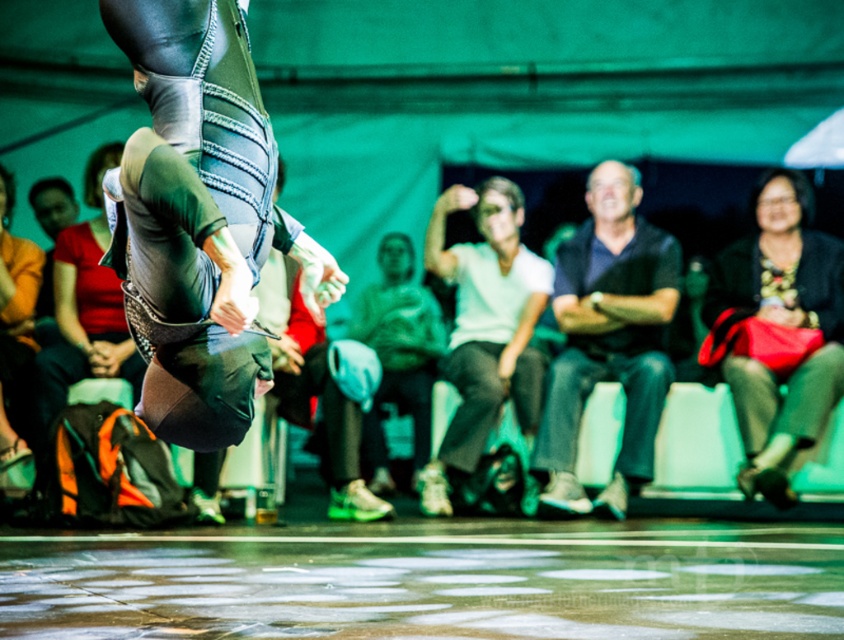
Between point (774, 484) and point (19, 340), which one is positioned behind?

Positioned behind is point (19, 340).

Does matte black sweater at right appear under orange fabric at lower left?

Correct, matte black sweater at right is located below orange fabric at lower left.

Is point (821, 305) less distant than point (14, 305)?

No, (821, 305) is further to viewer.

Where is `matte black sweater at right`? The image size is (844, 640). matte black sweater at right is located at coordinates (778, 328).

Can you confirm if white matte shirt at center is positioned above orange fabric at lower left?

Actually, white matte shirt at center is below orange fabric at lower left.

Who is more distant from viewer, (461, 381) or (14, 436)?

The point (461, 381) is behind.

This screenshot has width=844, height=640. What are the coordinates of `white matte shirt at center` in the screenshot? It's located at (485, 326).

Looking at this image, is dark blue shirt at center below white matte shirt at center?

No.

Find the location of a particular element. This screenshot has width=844, height=640. dark blue shirt at center is located at coordinates (609, 339).

Locate an element on the screen. The width and height of the screenshot is (844, 640). dark blue shirt at center is located at coordinates (609, 339).

You are a GUI agent. You are given a task and a screenshot of the screen. Output one action in this format:
    pyautogui.click(x=<x>, y=<y>)
    Task: Click on the dark blue shirt at center
    The width and height of the screenshot is (844, 640).
    Given the screenshot: What is the action you would take?
    pyautogui.click(x=609, y=339)